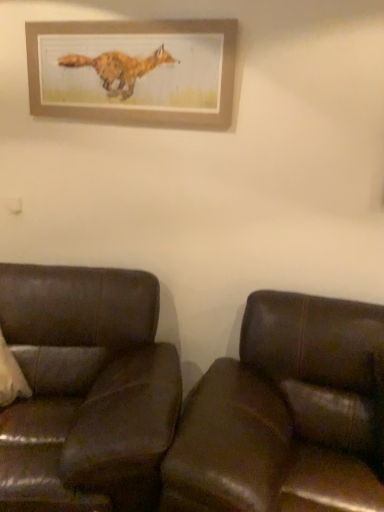
Question: Can you confirm if wooden picture frame at upper center is taller than brown leather couch at lower right, marked as the 1th studio couch in a right-to-left arrangement?

Choices:
 (A) no
 (B) yes

Answer: (A)

Question: Can you confirm if wooden picture frame at upper center is shorter than brown leather couch at lower right, marked as the 1th studio couch in a right-to-left arrangement?

Choices:
 (A) no
 (B) yes

Answer: (B)

Question: Is wooden picture frame at upper center at the left side of brown leather couch at lower right, the second studio couch when ordered from left to right?

Choices:
 (A) yes
 (B) no

Answer: (A)

Question: Is the depth of wooden picture frame at upper center less than that of brown leather couch at lower right, marked as the 1th studio couch in a right-to-left arrangement?

Choices:
 (A) yes
 (B) no

Answer: (B)

Question: From a real-world perspective, does wooden picture frame at upper center sit lower than brown leather couch at lower right, the second studio couch when ordered from left to right?

Choices:
 (A) yes
 (B) no

Answer: (B)

Question: From the image's perspective, does wooden picture frame at upper center appear lower than brown leather couch at lower right, marked as the 1th studio couch in a right-to-left arrangement?

Choices:
 (A) no
 (B) yes

Answer: (A)

Question: Can you confirm if wooden picture frame at upper center is thinner than brown leather couch at left, the 2th studio couch from the right?

Choices:
 (A) no
 (B) yes

Answer: (B)

Question: Is wooden picture frame at upper center smaller than brown leather couch at left, which is the 1th studio couch from left to right?

Choices:
 (A) yes
 (B) no

Answer: (A)

Question: Is wooden picture frame at upper center far away from brown leather couch at left, the 2th studio couch from the right?

Choices:
 (A) no
 (B) yes

Answer: (B)

Question: Is the surface of wooden picture frame at upper center in direct contact with brown leather couch at left, the 2th studio couch from the right?

Choices:
 (A) yes
 (B) no

Answer: (B)

Question: Considering the relative positions of wooden picture frame at upper center and brown leather couch at left, which is the 1th studio couch from left to right, in the image provided, is wooden picture frame at upper center in front of brown leather couch at left, which is the 1th studio couch from left to right,?

Choices:
 (A) no
 (B) yes

Answer: (A)

Question: From a real-world perspective, is wooden picture frame at upper center located higher than brown leather couch at left, the 2th studio couch from the right?

Choices:
 (A) yes
 (B) no

Answer: (A)

Question: Is brown leather couch at left, which is the 1th studio couch from left to right, behind brown leather couch at lower right, marked as the 1th studio couch in a right-to-left arrangement?

Choices:
 (A) yes
 (B) no

Answer: (A)